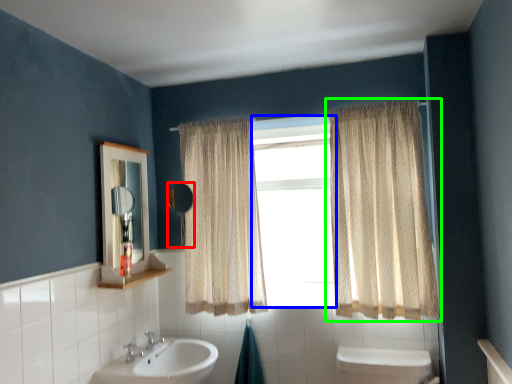
Question: Which is farther away from mirror (highlighted by a red box)? window (highlighted by a blue box) or curtain (highlighted by a green box)?

Choices:
 (A) window
 (B) curtain

Answer: (B)